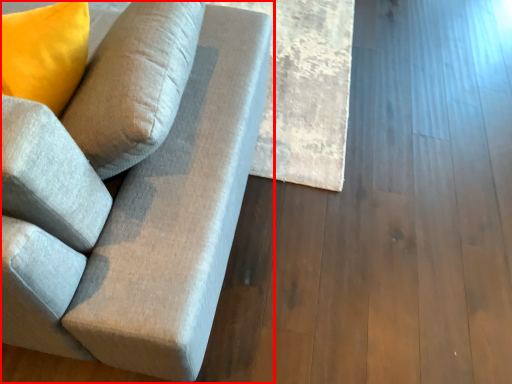
Question: From the image's perspective, where is studio couch (annotated by the red box) located in relation to plank in the image?

Choices:
 (A) above
 (B) below

Answer: (B)